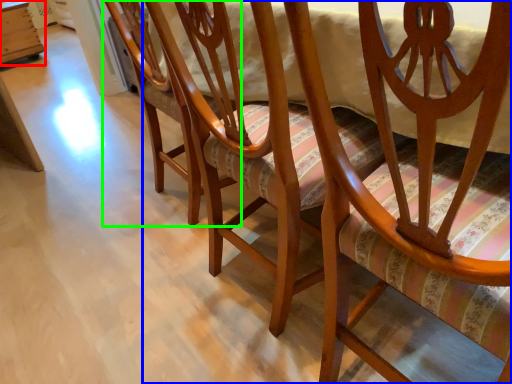
Question: Which is farther away from table (highlighted by a red box)? chair (highlighted by a blue box) or chair (highlighted by a green box)?

Choices:
 (A) chair
 (B) chair

Answer: (A)